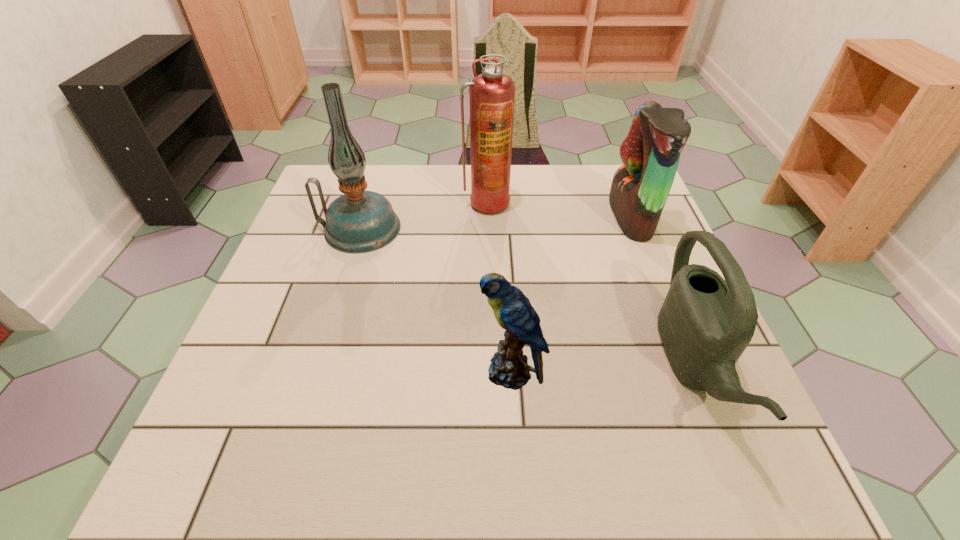
This screenshot has height=540, width=960. Identify the location of vacant region at the left edge of the desktop. coord(300,222).

You are a GUI agent. You are given a task and a screenshot of the screen. Output one action in this format:
    pyautogui.click(x=<x>, y=<y>)
    Task: Click on the vacant space at the near left corner of the desktop
    The image size is (960, 540).
    Given the screenshot: What is the action you would take?
    pyautogui.click(x=215, y=465)

Locate an element on the screen. This screenshot has width=960, height=540. vacant space at the far right corner of the desktop is located at coordinates (589, 173).

Find the location of a particular element. This screenshot has width=960, height=540. free space at the near right corner of the desktop is located at coordinates (745, 447).

The width and height of the screenshot is (960, 540). I want to click on free space between the leftmost object and the shorter parrot, so click(x=435, y=300).

The width and height of the screenshot is (960, 540). What are the coordinates of `free spot between the farther parrot and the leftmost object` in the screenshot? It's located at (495, 223).

You are a GUI agent. You are given a task and a screenshot of the screen. Output one action in this format:
    pyautogui.click(x=<x>, y=<y>)
    Task: Click on the vacant space in between the oil lamp and the fire extinguisher
    
    Given the screenshot: What is the action you would take?
    pyautogui.click(x=423, y=215)

At what (x,y) coordinates should I click in order to perform the action: click on unoccupied area between the fire extinguisher and the third tallest object. Please return your answer as a coordinate pair (x, y). This screenshot has width=960, height=540. Looking at the image, I should click on (559, 210).

Locate an element on the screen. The width and height of the screenshot is (960, 540). free spot between the right parrot and the watering can is located at coordinates (662, 292).

Identify the location of free spot between the watering can and the fire extinguisher. This screenshot has height=540, width=960. (590, 285).